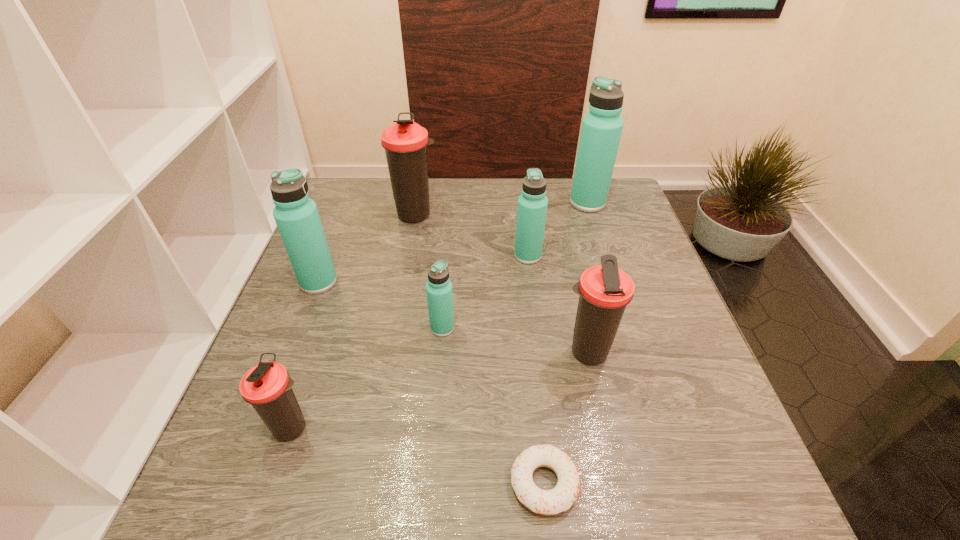
You are a GUI agent. You are given a task and a screenshot of the screen. Output one action in this format:
    pyautogui.click(x=<x>, y=<y>)
    Task: Click on the fifth object from right to left
    This screenshot has height=540, width=960.
    Given the screenshot: What is the action you would take?
    pyautogui.click(x=439, y=292)

Locate an element on the screen. The height and width of the screenshot is (540, 960). the fourth thermos bottle from right to left is located at coordinates (439, 292).

Where is `the nearest thermos bottle`? the nearest thermos bottle is located at coordinates (267, 386).

Where is `the smallest brown thermos bottle`? This screenshot has height=540, width=960. the smallest brown thermos bottle is located at coordinates [x=267, y=386].

Locate an element on the screen. The width and height of the screenshot is (960, 540). white doughnut is located at coordinates (546, 502).

This screenshot has height=540, width=960. I want to click on the shortest object, so click(546, 502).

The image size is (960, 540). I want to click on vacant space situated on the back of the biggest aqua thermos bottle, so click(x=582, y=183).

Locate an element on the screen. vacant position located on the right of the biggest brown thermos bottle is located at coordinates (526, 214).

Find the location of a particular element. The image size is (960, 540). vacant space situated 0.350m on the front of the fourth farthest thermos bottle is located at coordinates (260, 434).

The width and height of the screenshot is (960, 540). In order to click on vacant space located on the back of the fifth thermos bottle from left to right in this screenshot , I will do `click(522, 207)`.